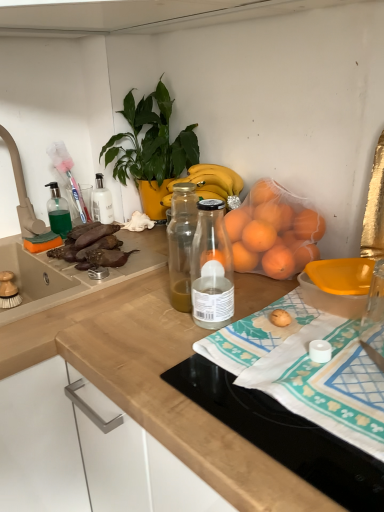
Locate an element on the screen. This screenshot has height=512, width=384. vacant point above wooden at upper right, positioned as the second countertop in left-to-right order (from a real-world perspective) is located at coordinates (321, 357).